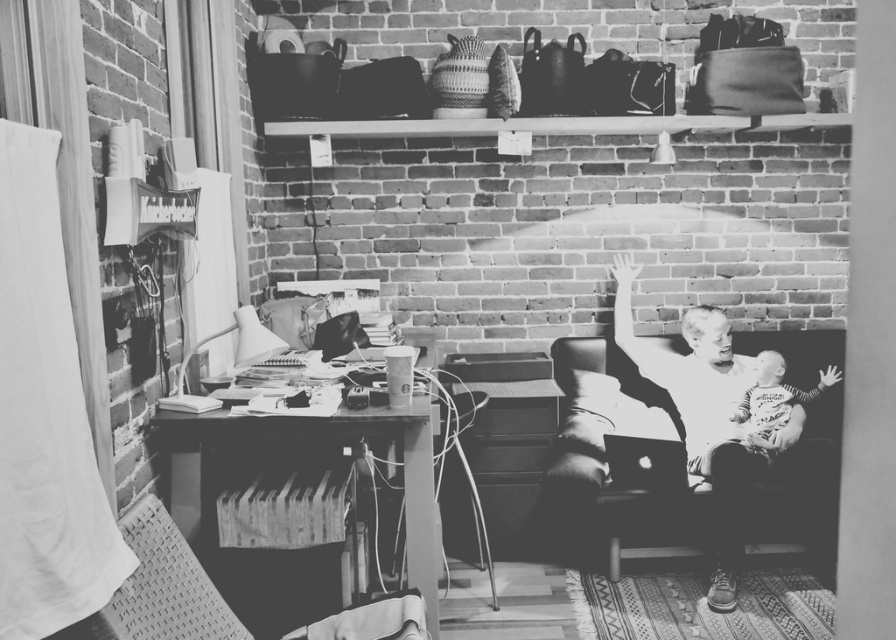
From the picture: You are organizing a small gathering in this home office and need to move the soft leather couch at center closer to the wooden desk at left. Based on their current positions, which direction should you move the couch to place it next to the desk?

The soft leather couch at center should be moved to the left side of the wooden desk at left since it is currently positioned on the right side of the desk.

In the scene shown: You are standing in the middle of the room and want to sit down. There is a soft leather couch at center. Can you walk directly to it without moving any objects?

The soft leather couch at center is positioned at point (604, 464), so yes, you can walk directly to it without needing to move any objects as there are no obstacles mentioned in the scene description.

You are a delivery person trying to deliver a package to the wooden desk at left in a room with a soft leather couch at center. The package is 1.3 meters long. Can you slide the package from the couch to the desk without bending it?

The distance between the soft leather couch at center and the wooden desk at left is 1.29 meters. Since the package is 1.3 meters long, it is slightly longer than the available space. Therefore, you cannot slide the package without bending it.